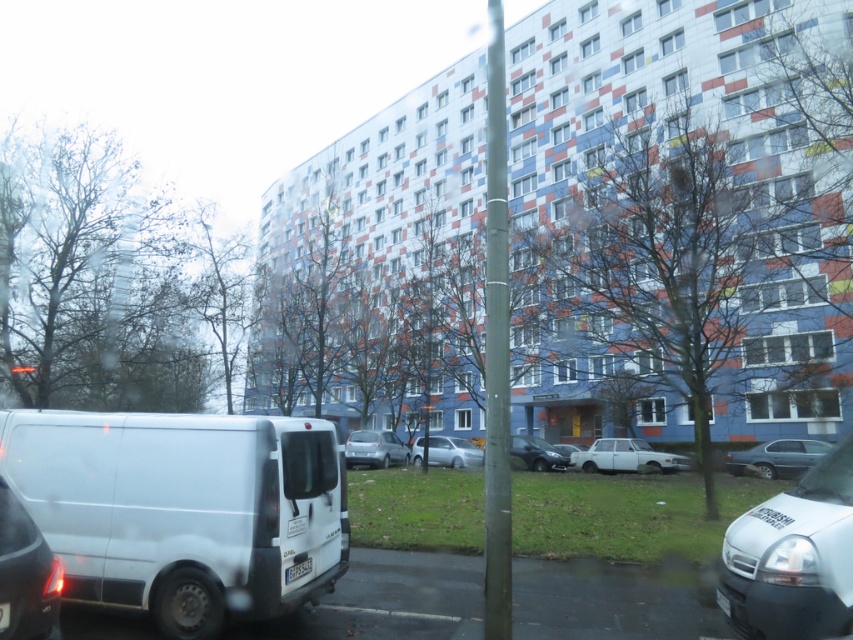
You are a delivery driver who needs to park your vehicle in the parking lot shown in the image. You see the matte white van at lower left and the satin silver sedan at center. Which vehicle is closer to the entrance of the parking lot?

The matte white van at lower left is positioned on the right side of the satin silver sedan at center, so the satin silver sedan at center is closer to the entrance of the parking lot.

Consider the image. You are a delivery driver who needs to park your white matte van at left in a spot that can accommodate its width. There is another matte white van at lower left already parked. Based on the scene, can you determine if your van will fit in the available space next to the existing van?

The white matte van at left might be wider than the matte white van at lower left, so there is a possibility that it may not fit in the available space next to the existing van. It is recommended to check the width of both vehicles before proceeding.